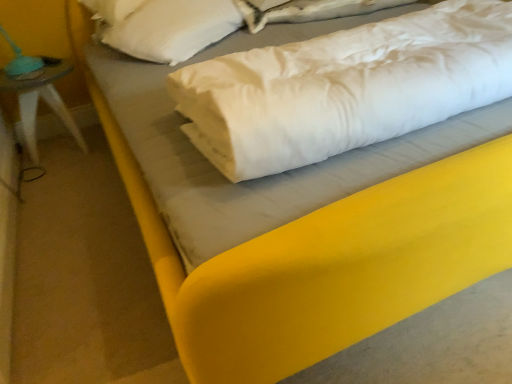
Question: From a real-world perspective, is white soft pillow at center physically located above or below teal fabric lampshade at left?

Choices:
 (A) above
 (B) below

Answer: (A)

Question: From their relative heights in the image, would you say white soft pillow at center is taller or shorter than teal fabric lampshade at left?

Choices:
 (A) short
 (B) tall

Answer: (A)

Question: Considering the real-world distances, which object is farthest from the white soft pillow at center?

Choices:
 (A) white soft pillow at upper left
 (B) white satin sheet at upper center
 (C) teal fabric lampshade at left

Answer: (C)

Question: Estimate the real-world distances between objects in this image. Which object is closer to the white soft pillow at center?

Choices:
 (A) teal fabric lampshade at left
 (B) white soft pillow at upper left
 (C) white satin sheet at upper center

Answer: (C)